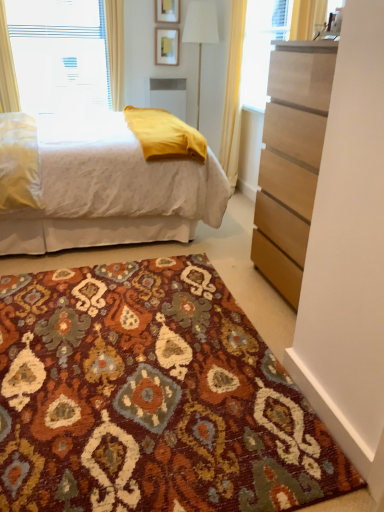
Question: Is white plastic window at upper left at the left side of multicolored woven rug at center?

Choices:
 (A) yes
 (B) no

Answer: (A)

Question: Is white plastic window at upper left bigger than multicolored woven rug at center?

Choices:
 (A) no
 (B) yes

Answer: (A)

Question: Is white plastic window at upper left positioned beyond the bounds of multicolored woven rug at center?

Choices:
 (A) no
 (B) yes

Answer: (B)

Question: Does white plastic window at upper left have a smaller size compared to multicolored woven rug at center?

Choices:
 (A) yes
 (B) no

Answer: (A)

Question: From a real-world perspective, is white plastic window at upper left under multicolored woven rug at center?

Choices:
 (A) yes
 (B) no

Answer: (B)

Question: Could you tell me if white plastic window at upper left is facing multicolored woven rug at center?

Choices:
 (A) no
 (B) yes

Answer: (B)

Question: From the image's perspective, does white fabric lampshade at center appear higher than white plastic window at upper left?

Choices:
 (A) yes
 (B) no

Answer: (B)

Question: From the image's perspective, is white fabric lampshade at center located beneath white plastic window at upper left?

Choices:
 (A) no
 (B) yes

Answer: (B)

Question: Is white fabric lampshade at center facing towards white plastic window at upper left?

Choices:
 (A) no
 (B) yes

Answer: (A)

Question: Can you confirm if white fabric lampshade at center is bigger than white plastic window at upper left?

Choices:
 (A) no
 (B) yes

Answer: (B)

Question: Is white fabric lampshade at center closer to the viewer compared to white plastic window at upper left?

Choices:
 (A) yes
 (B) no

Answer: (B)

Question: Is white fabric lampshade at center shorter than white plastic window at upper left?

Choices:
 (A) no
 (B) yes

Answer: (A)

Question: Is wooden picture frame at upper center, positioned as the 1th picture frame in top-to-bottom order, thinner than white plastic window at upper left?

Choices:
 (A) no
 (B) yes

Answer: (B)